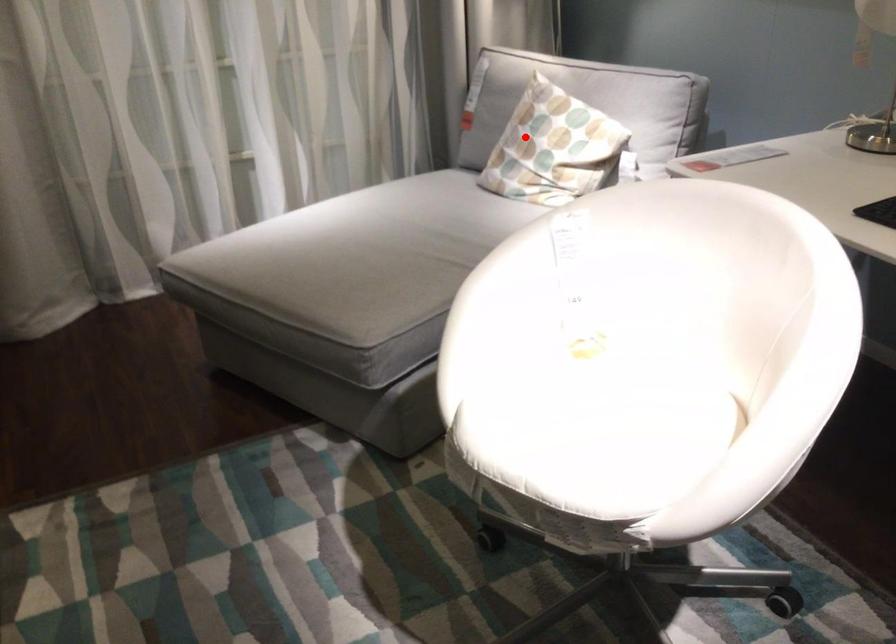
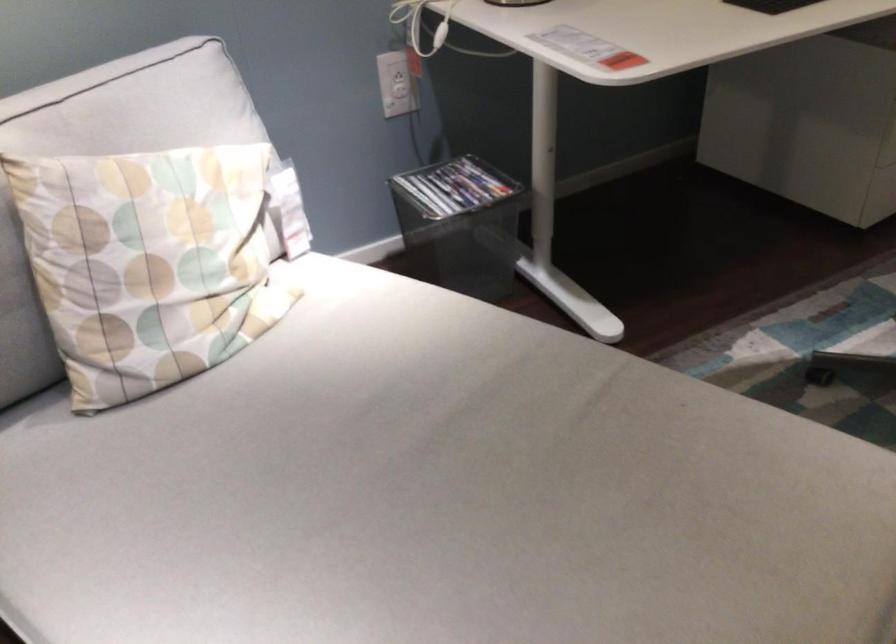
Question: A red point is marked in image1. In image2, is the corresponding 3D point closer to the camera or farther? Reply with the corresponding letter.

Choices:
 (A) The corresponding 3D point is closer.
 (B) The corresponding 3D point is farther.

Answer: (A)